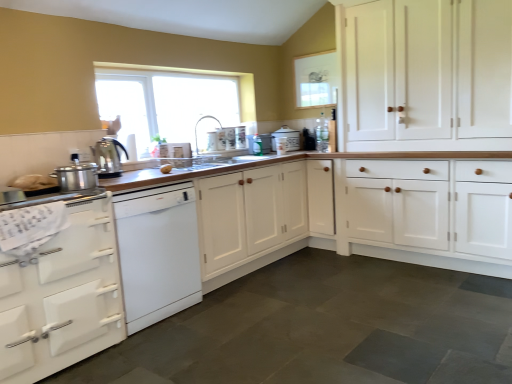
Question: Can you confirm if white wood cabinet at right, which is the 3th cabinetry in left-to-right order, is bigger than white glossy dishwasher at left?

Choices:
 (A) yes
 (B) no

Answer: (A)

Question: Is white wood cabinet at right, which is the 3th cabinetry in left-to-right order, completely or partially outside of white glossy dishwasher at left?

Choices:
 (A) no
 (B) yes

Answer: (B)

Question: From the image's perspective, is white wood cabinet at right, which is the 3th cabinetry in left-to-right order, located beneath white glossy dishwasher at left?

Choices:
 (A) yes
 (B) no

Answer: (B)

Question: Considering the relative sizes of white wood cabinet at right, which is the 3th cabinetry in left-to-right order, and white glossy dishwasher at left in the image provided, is white wood cabinet at right, which is the 3th cabinetry in left-to-right order, taller than white glossy dishwasher at left?

Choices:
 (A) yes
 (B) no

Answer: (A)

Question: Could white glossy dishwasher at left be considered to be inside white wood cabinet at right, which is the 3th cabinetry in left-to-right order?

Choices:
 (A) no
 (B) yes

Answer: (A)

Question: Is slate gray stone countertop at lower left wider or thinner than polished stainless steel pot at left, acting as the 1th kitchen appliance starting from the front?

Choices:
 (A) thin
 (B) wide

Answer: (B)

Question: In terms of height, does slate gray stone countertop at lower left look taller or shorter compared to polished stainless steel pot at left, acting as the 1th kitchen appliance starting from the front?

Choices:
 (A) tall
 (B) short

Answer: (B)

Question: Is slate gray stone countertop at lower left spatially inside polished stainless steel pot at left, acting as the 1th kitchen appliance starting from the front, or outside of it?

Choices:
 (A) outside
 (B) inside

Answer: (A)

Question: Is slate gray stone countertop at lower left bigger or smaller than polished stainless steel pot at left, which is counted as the second kitchen appliance, starting from the back?

Choices:
 (A) big
 (B) small

Answer: (A)

Question: Is point (172, 225) closer or farther from the camera than point (496, 1)?

Choices:
 (A) farther
 (B) closer

Answer: (B)

Question: Looking at the image, does white glossy dishwasher at left seem bigger or smaller compared to white wood cabinet at right, which is the 3th cabinetry in left-to-right order?

Choices:
 (A) small
 (B) big

Answer: (A)

Question: Considering the positions of white glossy dishwasher at left and white wood cabinet at right, marked as the 1th cabinetry in a right-to-left arrangement, in the image, is white glossy dishwasher at left taller or shorter than white wood cabinet at right, marked as the 1th cabinetry in a right-to-left arrangement,?

Choices:
 (A) short
 (B) tall

Answer: (A)

Question: In the image, is white glossy dishwasher at left positioned in front of or behind white wood cabinet at right, which is the 3th cabinetry in left-to-right order?

Choices:
 (A) front
 (B) behind

Answer: (A)

Question: Is point (16, 344) positioned closer to the camera than point (164, 168)?

Choices:
 (A) farther
 (B) closer

Answer: (B)

Question: Is white matte oven at lower left, arranged as the third cabinetry when viewed from the right, bigger or smaller than yellow matte potato at center?

Choices:
 (A) small
 (B) big

Answer: (B)